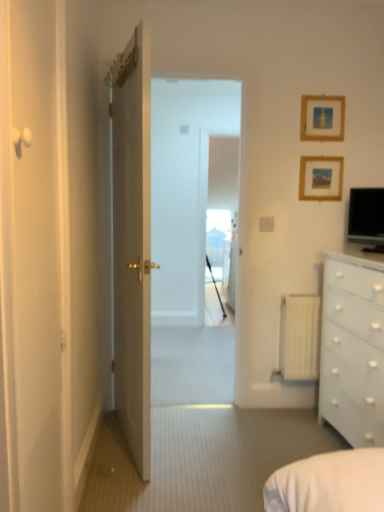
Question: From a real-world perspective, is transparent glass window at center located higher than black glossy monitor at upper right?

Choices:
 (A) yes
 (B) no

Answer: (B)

Question: Is transparent glass window at center positioned in front of black glossy monitor at upper right?

Choices:
 (A) yes
 (B) no

Answer: (B)

Question: Can you confirm if transparent glass window at center is smaller than black glossy monitor at upper right?

Choices:
 (A) no
 (B) yes

Answer: (A)

Question: From the image's perspective, would you say transparent glass window at center is shown under black glossy monitor at upper right?

Choices:
 (A) no
 (B) yes

Answer: (B)

Question: Are transparent glass window at center and black glossy monitor at upper right beside each other?

Choices:
 (A) yes
 (B) no

Answer: (B)

Question: From the image's perspective, is white matte radiator at right above or below white glossy chest of drawers at right?

Choices:
 (A) below
 (B) above

Answer: (B)

Question: Is point (314, 352) positioned closer to the camera than point (334, 306)?

Choices:
 (A) farther
 (B) closer

Answer: (A)

Question: Is white matte radiator at right in front of or behind white glossy chest of drawers at right in the image?

Choices:
 (A) front
 (B) behind

Answer: (B)

Question: Looking at the image, does white matte radiator at right seem bigger or smaller compared to white glossy chest of drawers at right?

Choices:
 (A) small
 (B) big

Answer: (A)

Question: In terms of size, does white glossy door at center, placed as the second door when sorted from front to back, appear bigger or smaller than white glossy chest of drawers at right?

Choices:
 (A) big
 (B) small

Answer: (B)

Question: Is white glossy door at center, acting as the 1th door starting from the back, in front of or behind white glossy chest of drawers at right in the image?

Choices:
 (A) front
 (B) behind

Answer: (B)

Question: From the image's perspective, is white glossy door at center, acting as the 1th door starting from the back, above or below white glossy chest of drawers at right?

Choices:
 (A) below
 (B) above

Answer: (B)

Question: From a real-world perspective, is white glossy door at center, placed as the second door when sorted from front to back, above or below white glossy chest of drawers at right?

Choices:
 (A) above
 (B) below

Answer: (A)

Question: Is transparent glass window at center in front of or behind wooden picture frame at upper right, the 1th picture frame positioned from the top, in the image?

Choices:
 (A) behind
 (B) front

Answer: (A)

Question: From a real-world perspective, is transparent glass window at center positioned above or below wooden picture frame at upper right, the 1th picture frame positioned from the top?

Choices:
 (A) above
 (B) below

Answer: (B)